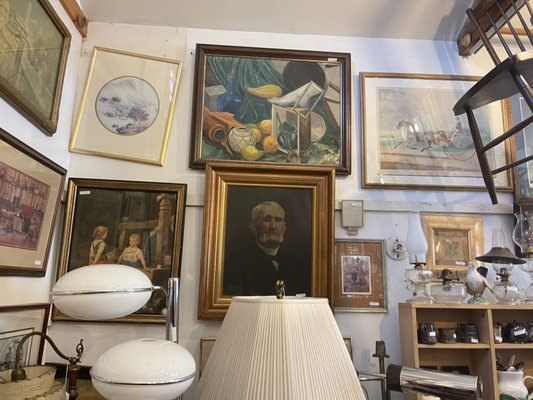
Locate an element on the screen. clear oil lamp is located at coordinates (505, 287).